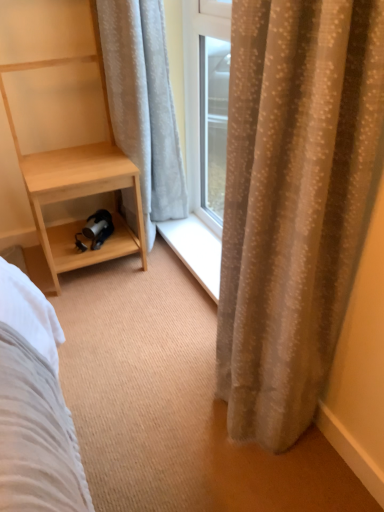
This screenshot has width=384, height=512. I want to click on spots to the right of light wood/texture shelf at left, so click(163, 280).